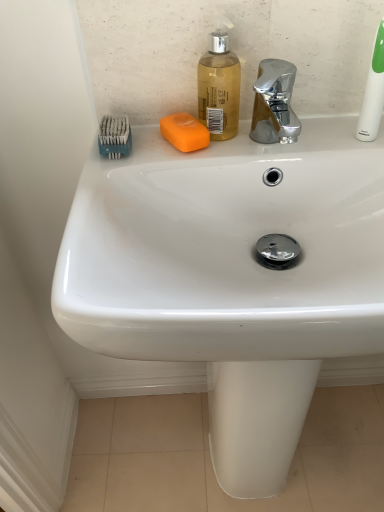
Identify the location of free spot to the right of teal plastic toothbrush at upper left. The width and height of the screenshot is (384, 512). (221, 145).